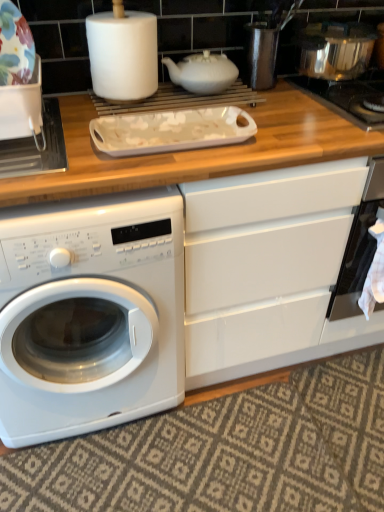
Question: Is black glass oven at right far from shiny metallic pot at upper right, the second appliance in the left-to-right sequence?

Choices:
 (A) no
 (B) yes

Answer: (A)

Question: From the image's perspective, is black glass oven at right beneath shiny metallic pot at upper right, the first appliance viewed from the top?

Choices:
 (A) yes
 (B) no

Answer: (A)

Question: Does black glass oven at right lie in front of shiny metallic pot at upper right, which ranks as the first appliance in right-to-left order?

Choices:
 (A) no
 (B) yes

Answer: (B)

Question: Is black glass oven at right positioned with its back to shiny metallic pot at upper right, the first appliance when ordered from back to front?

Choices:
 (A) no
 (B) yes

Answer: (A)

Question: Is black glass oven at right taller than shiny metallic pot at upper right, arranged as the second appliance when viewed from the front?

Choices:
 (A) yes
 (B) no

Answer: (A)

Question: Choose the correct answer: Is white matte teapot at upper center inside white matte paper towel at upper center or outside it?

Choices:
 (A) inside
 (B) outside

Answer: (B)

Question: Visually, is white matte teapot at upper center positioned to the left or to the right of white matte paper towel at upper center?

Choices:
 (A) right
 (B) left

Answer: (A)

Question: Looking at their shapes, would you say white matte teapot at upper center is wider or thinner than white matte paper towel at upper center?

Choices:
 (A) thin
 (B) wide

Answer: (B)

Question: Considering their positions, is white matte teapot at upper center located in front of or behind white matte paper towel at upper center?

Choices:
 (A) front
 (B) behind

Answer: (B)

Question: Is white glossy washing machine at lower left inside or outside of shiny metallic pot at upper right, the first appliance when ordered from back to front?

Choices:
 (A) outside
 (B) inside

Answer: (A)

Question: From the image's perspective, is white glossy washing machine at lower left located above or below shiny metallic pot at upper right, the second appliance in the left-to-right sequence?

Choices:
 (A) below
 (B) above

Answer: (A)

Question: In terms of width, does white glossy washing machine at lower left look wider or thinner when compared to shiny metallic pot at upper right, which appears as the second appliance when ordered from the bottom?

Choices:
 (A) thin
 (B) wide

Answer: (B)

Question: Based on their sizes in the image, would you say white glossy washing machine at lower left is bigger or smaller than shiny metallic pot at upper right, the first appliance when ordered from back to front?

Choices:
 (A) small
 (B) big

Answer: (B)

Question: Does point (109, 13) appear closer or farther from the camera than point (321, 46)?

Choices:
 (A) closer
 (B) farther

Answer: (A)

Question: From a real-world perspective, is white matte paper towel at upper center physically located above or below shiny metallic pot at upper right, which appears as the second appliance when ordered from the bottom?

Choices:
 (A) above
 (B) below

Answer: (A)